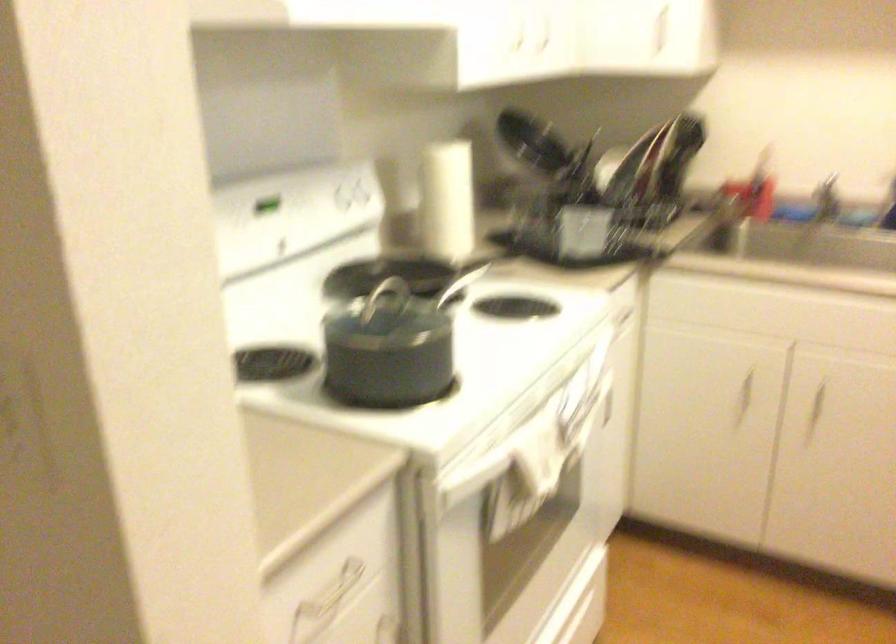
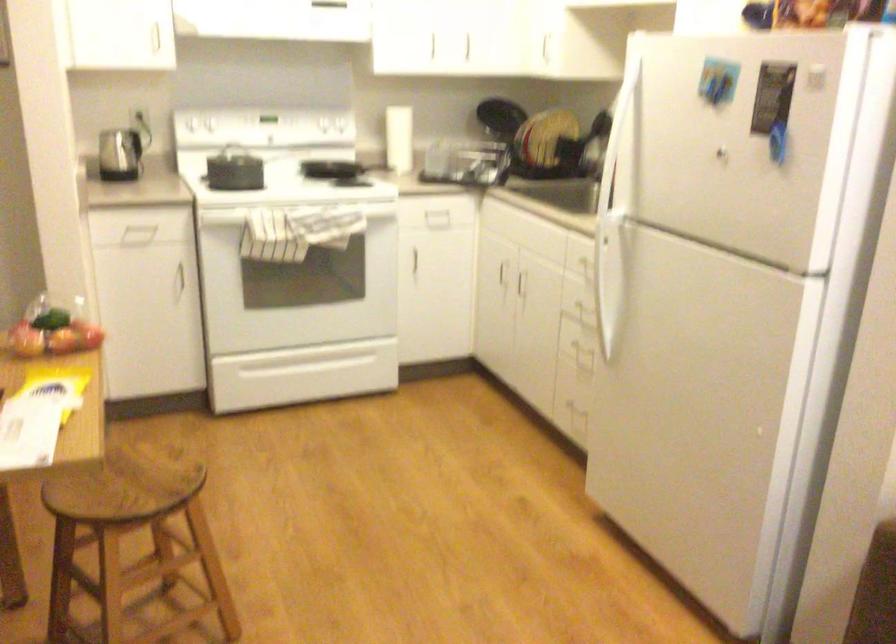
In the second image, find the point that corresponds to the point at 529,509 in the first image.

(289, 261)